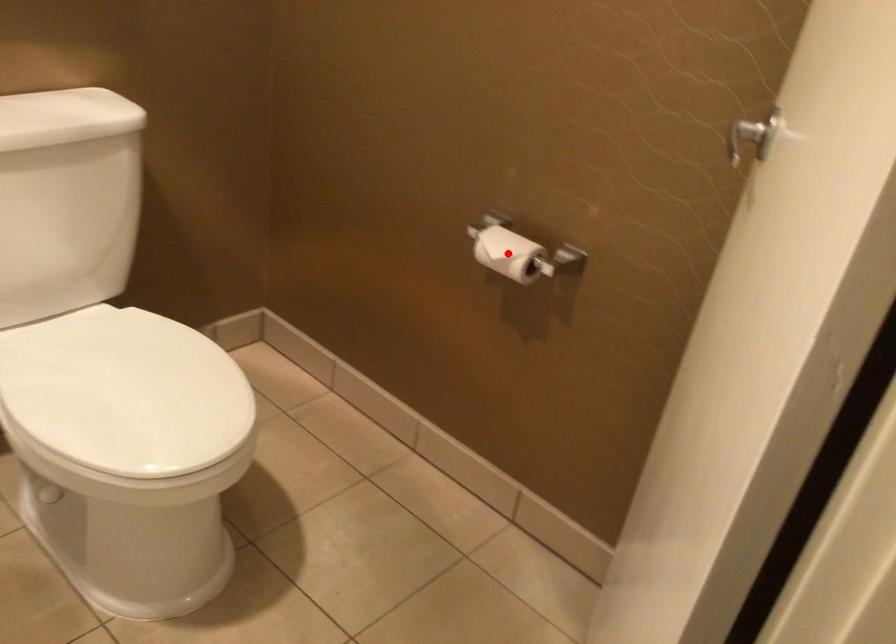
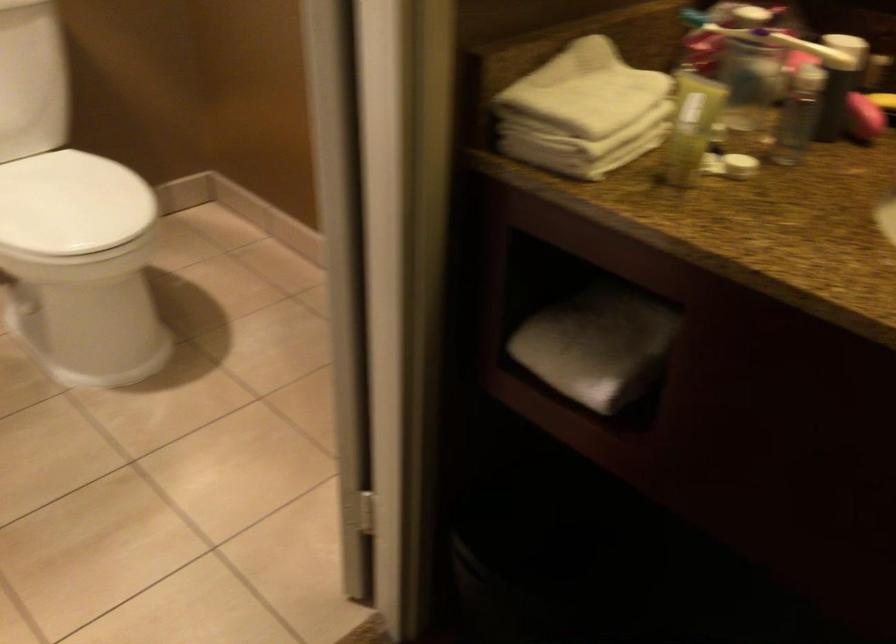
Question: I am providing you with two images of the same scene from different viewpoints. A red point is marked on the first image. Can you still see the location of the red point in image 2?

Choices:
 (A) Yes
 (B) No

Answer: (B)